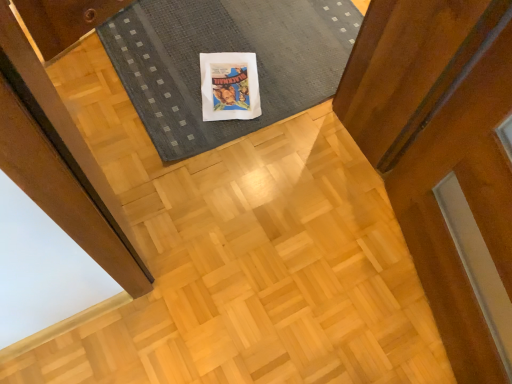
Find the location of a particular element. The image size is (512, 384). unoccupied space behind matte white comic book at center is located at coordinates click(241, 38).